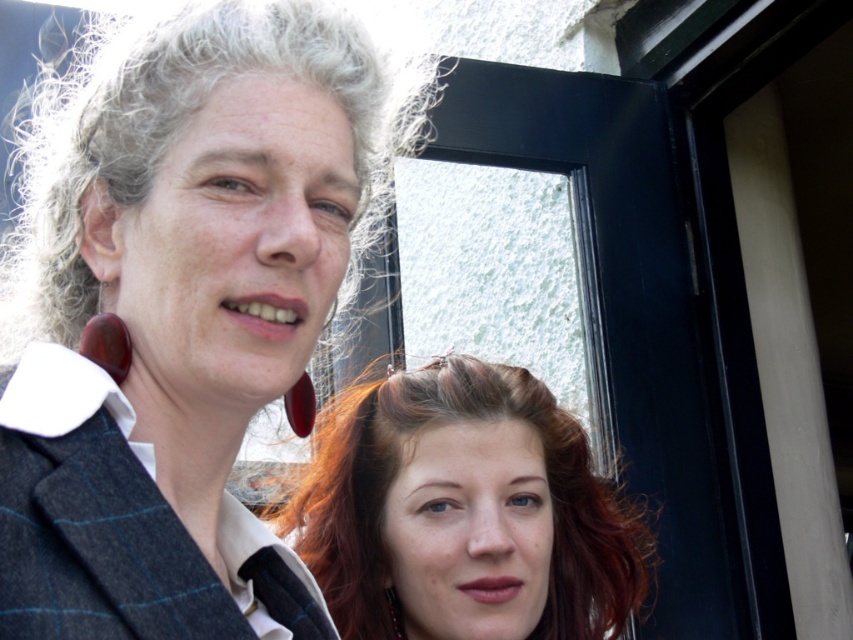
From the picture: You are a photographer adjusting your camera settings to focus on both the shiny brown hair at center and the gray curly hair at upper left. Which hair should you focus on first to ensure both are in sharp focus?

You should focus on the shiny brown hair at center first because it is closer to the viewer than the gray curly hair at upper left, so adjusting focus starting from the closer object ensures both will be in sharp focus.

You are a photographer setting up for a group photo. You need to position two people so that the distance between their hair is exactly 1.06 meters. Given the current positions of the shiny brown hair at center and the gray curly hair at upper left, can they stay in their current spots for the photo?

Yes, the shiny brown hair at center and the gray curly hair at upper left can stay in their current spots because the distance between them is already 1.06 meters.

You are taking a photo of the scene and want to ensure the shiny brown hair at center is centered in the frame. Given its current position at coordinates, is it already centered?

Result: The shiny brown hair at center is located at coordinates point (463, 513), which means it is not perfectly centered in the frame since the center point would be (426, 320). To center it, adjust the camera to move the hair slightly to the left and down.